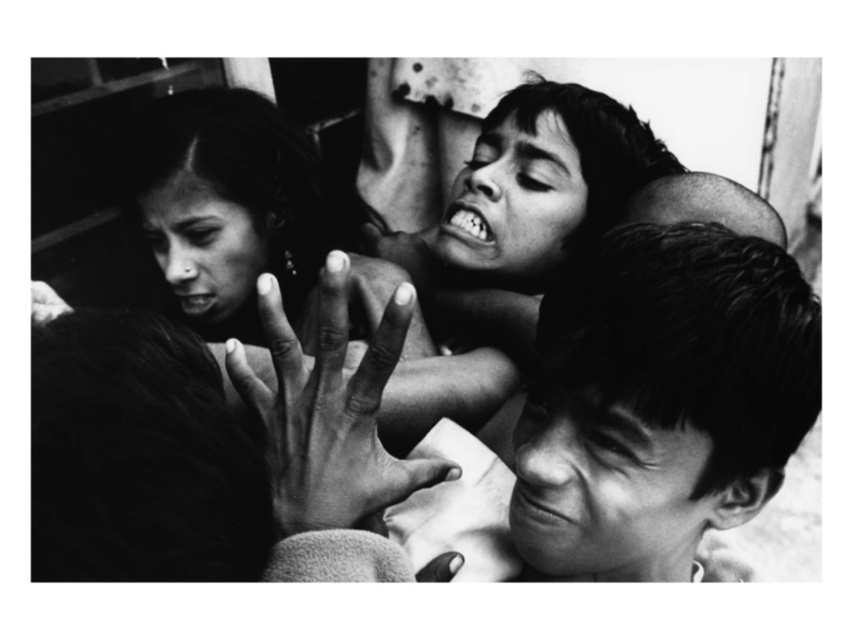
Between smooth skin face at center and smooth skin hand at center, which one has more height?

Standing taller between the two is smooth skin face at center.

Between smooth skin face at center and smooth skin hand at center, which one is positioned higher?

smooth skin hand at center is higher up.

The height and width of the screenshot is (640, 853). What do you see at coordinates (660, 401) in the screenshot? I see `smooth skin face at center` at bounding box center [660, 401].

Locate an element on the screen. This screenshot has width=853, height=640. smooth skin face at center is located at coordinates (660, 401).

From the picture: Between smooth skin hand at center and smooth skin hand at lower left, which one has less height?

Standing shorter between the two is smooth skin hand at lower left.

Between point (270, 298) and point (42, 285), which one is positioned in front?

Positioned in front is point (270, 298).

Find the location of a particular element. This screenshot has width=853, height=640. smooth skin hand at center is located at coordinates (329, 410).

Based on the photo, who is more forward, (368,390) or (35,308)?

Positioned in front is point (368,390).

Measure the distance between smooth skin face at center and smooth skin hand at lower left.

They are 12.50 inches apart.

Who is more distant from viewer, (572, 541) or (45, 320)?

The point (45, 320) is more distant.

At what (x,y) coordinates should I click in order to perform the action: click on smooth skin face at center. Please return your answer as a coordinate pair (x, y). This screenshot has width=853, height=640. Looking at the image, I should click on (660, 401).